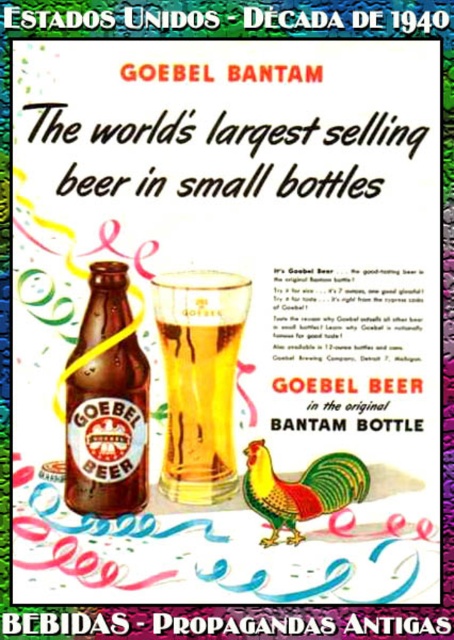
Question: Does golden glass beer at center appear on the left side of brown glass bottle at center?

Choices:
 (A) no
 (B) yes

Answer: (A)

Question: Is golden glass beer at center to the left of glossy ceramic rooster at center from the viewer's perspective?

Choices:
 (A) no
 (B) yes

Answer: (B)

Question: Which point appears closest to the camera in this image?

Choices:
 (A) (327, 509)
 (B) (74, 396)
 (C) (183, 380)

Answer: (A)

Question: Which point is farther to the camera?

Choices:
 (A) brown glass bottle at center
 (B) golden glass beer at center
 (C) glossy ceramic rooster at center

Answer: (B)

Question: Which point is farther to the camera?

Choices:
 (A) brown glass bottle at center
 (B) glossy ceramic rooster at center
 (C) golden glass beer at center

Answer: (C)

Question: Does golden glass beer at center lie in front of brown glass bottle at center?

Choices:
 (A) yes
 (B) no

Answer: (B)